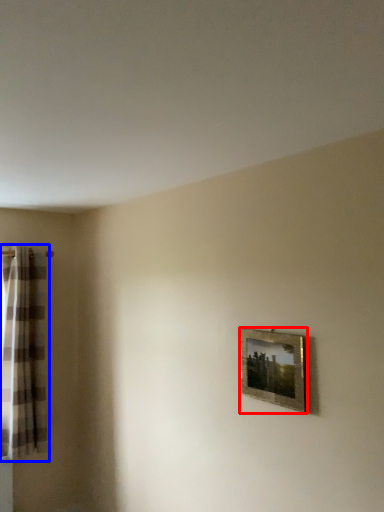
Question: Among these objects, which one is farthest to the camera, picture frame (highlighted by a red box) or curtain (highlighted by a blue box)?

Choices:
 (A) picture frame
 (B) curtain

Answer: (B)